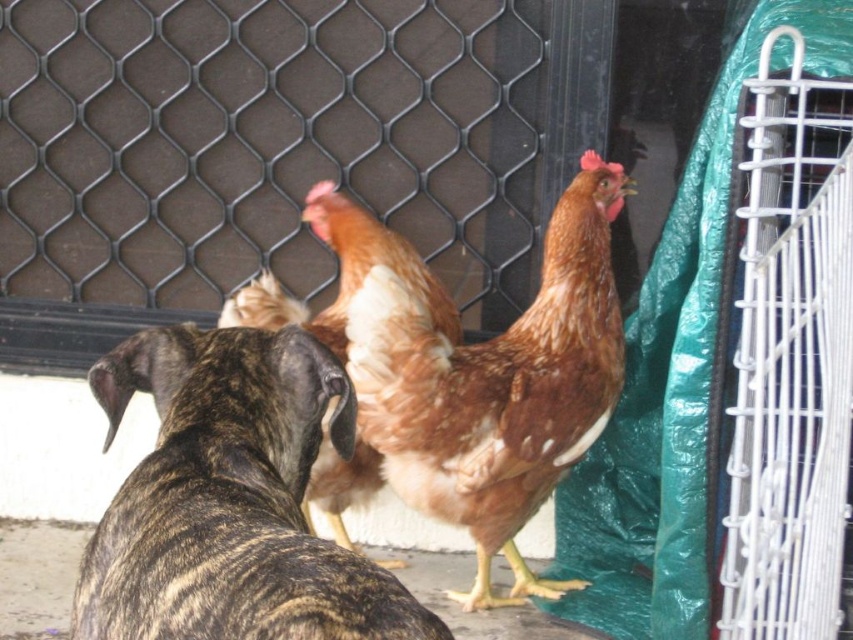
You are a farmer checking the safety of your animals. You notice the brindle fur dog at center and the brown feathered chicken at center. Which animal is narrower in width?

The brindle fur dog at center has a lesser width compared to the brown feathered chicken at center, so the dog is narrower.

You are a farmer observing the scene. You need to separate the brindle fur dog at center and the brown feathered chicken at center using the metal fence. Which side of the fence should you place the chicken on to keep it away from the dog?

The brindle fur dog at center is positioned on the left side of brown feathered chicken at center. To keep the chicken away from the dog, you should place the brown feathered chicken at center on the right side of the metal fence so that the dog cannot reach it.